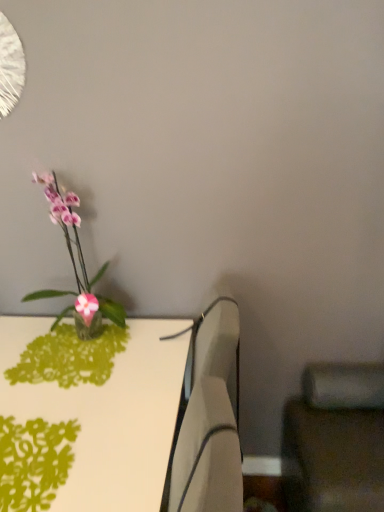
Question: From the image's perspective, is matte black swivel chair at lower right, which is counted as the second swivel chair, starting from the left, located above green papercut at lower left?

Choices:
 (A) no
 (B) yes

Answer: (A)

Question: Could you tell me if matte black swivel chair at lower right, which appears as the first swivel chair when viewed from the right, is facing green papercut at lower left?

Choices:
 (A) yes
 (B) no

Answer: (B)

Question: Does matte black swivel chair at lower right, which appears as the first swivel chair when viewed from the right, have a lesser height compared to green papercut at lower left?

Choices:
 (A) no
 (B) yes

Answer: (A)

Question: Is green papercut at lower left completely or partially inside matte black swivel chair at lower right, which appears as the first swivel chair when viewed from the right?

Choices:
 (A) yes
 (B) no

Answer: (B)

Question: Is matte black swivel chair at lower right, which appears as the first swivel chair when viewed from the right, not near green papercut at lower left?

Choices:
 (A) yes
 (B) no

Answer: (B)

Question: Considering their positions, is white plastic swivel chair at center, which is the second swivel chair in right-to-left order, located in front of or behind pink glass vase at left?

Choices:
 (A) front
 (B) behind

Answer: (B)

Question: Is white plastic swivel chair at center, the first swivel chair from the left, bigger or smaller than pink glass vase at left?

Choices:
 (A) big
 (B) small

Answer: (B)

Question: From the image's perspective, relative to pink glass vase at left, is white plastic swivel chair at center, the first swivel chair from the left, above or below?

Choices:
 (A) below
 (B) above

Answer: (A)

Question: Is white plastic swivel chair at center, which is the second swivel chair in right-to-left order, inside or outside of pink glass vase at left?

Choices:
 (A) inside
 (B) outside

Answer: (B)

Question: From a real-world perspective, relative to green papercut at lower left, is white plastic swivel chair at center, which is the second swivel chair in right-to-left order, vertically above or below?

Choices:
 (A) below
 (B) above

Answer: (A)

Question: From their relative heights in the image, would you say white plastic swivel chair at center, which is the second swivel chair in right-to-left order, is taller or shorter than green papercut at lower left?

Choices:
 (A) tall
 (B) short

Answer: (A)

Question: In terms of size, does white plastic swivel chair at center, which is the second swivel chair in right-to-left order, appear bigger or smaller than green papercut at lower left?

Choices:
 (A) small
 (B) big

Answer: (B)

Question: Is point (178, 475) closer or farther from the camera than point (26, 421)?

Choices:
 (A) farther
 (B) closer

Answer: (B)

Question: In terms of width, does green papercut at lower left look wider or thinner when compared to white plastic swivel chair at center, the first swivel chair from the left?

Choices:
 (A) thin
 (B) wide

Answer: (B)

Question: Relative to white plastic swivel chair at center, which is the second swivel chair in right-to-left order, is green papercut at lower left in front or behind?

Choices:
 (A) behind
 (B) front

Answer: (B)